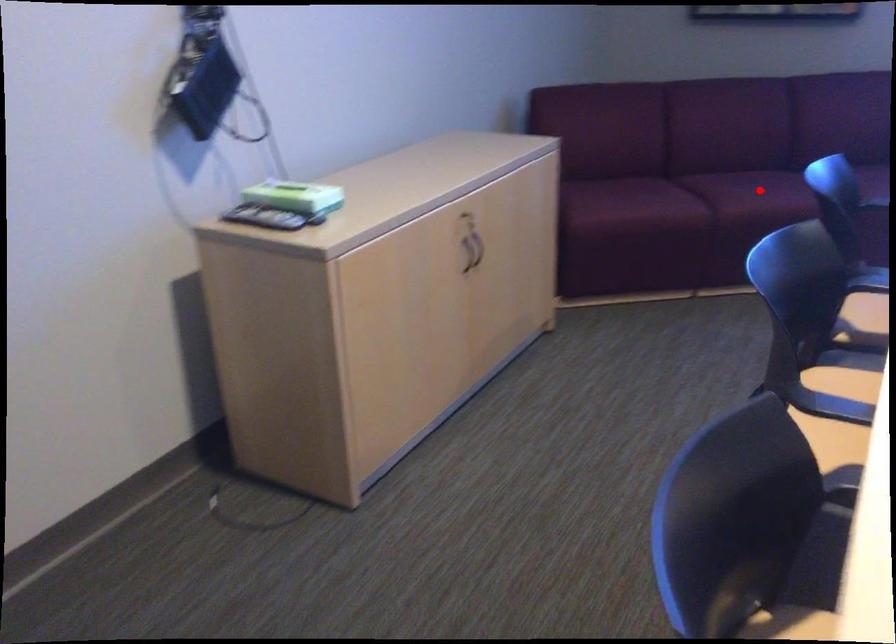
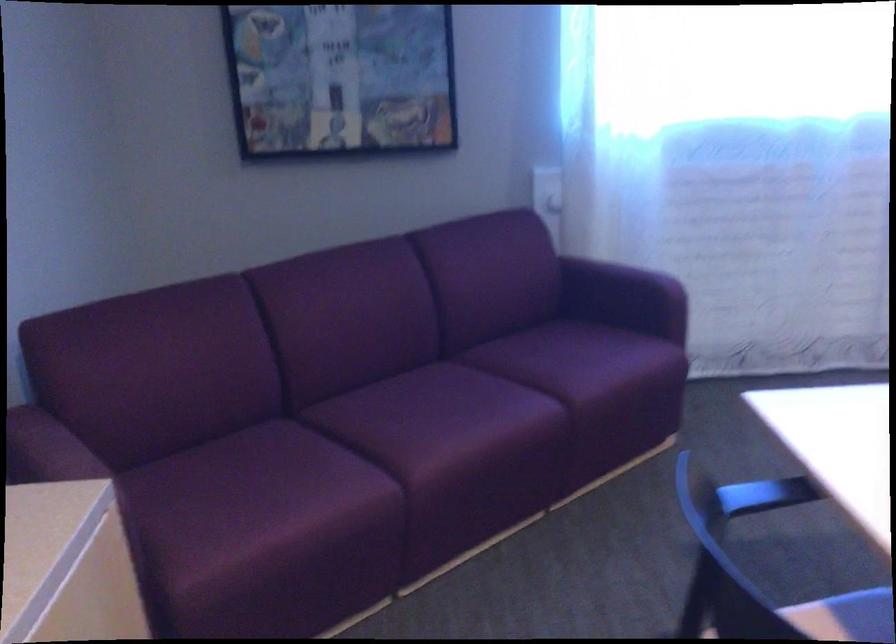
Locate, in the second image, the point that corresponds to the highlighted location in the first image.

(445, 422)